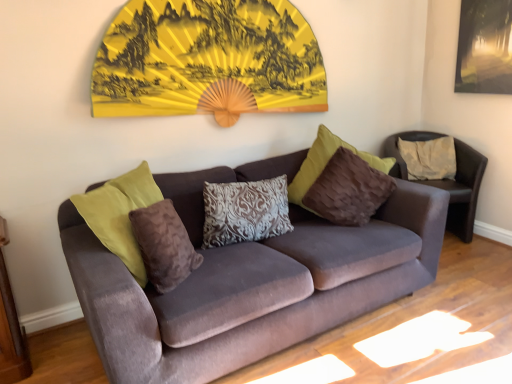
Question: Is velvet brown armchair at center situated inside yellow paper fan at upper center or outside?

Choices:
 (A) outside
 (B) inside

Answer: (A)

Question: In terms of width, does velvet brown armchair at center look wider or thinner when compared to yellow paper fan at upper center?

Choices:
 (A) thin
 (B) wide

Answer: (B)

Question: Which object is the farthest from the brown velvety pillow at center, which appears as the 3th pillow when viewed from the back?

Choices:
 (A) matte black picture frame at upper right
 (B) yellow paper fan at upper center
 (C) velvet brown armchair at center
 (D) velvet couch at center
 (E) beige fabric pillow at right, which is the first pillow from back to front

Answer: (A)

Question: Which object is positioned farthest from the velvet couch at center?

Choices:
 (A) patterned fabric pillow at center, the second pillow viewed from the left
 (B) beige fabric pillow at right, which is the first pillow from back to front
 (C) brown velvety pillow at center, placed as the 1th pillow when sorted from front to back
 (D) yellow paper fan at upper center
 (E) matte black picture frame at upper right

Answer: (E)